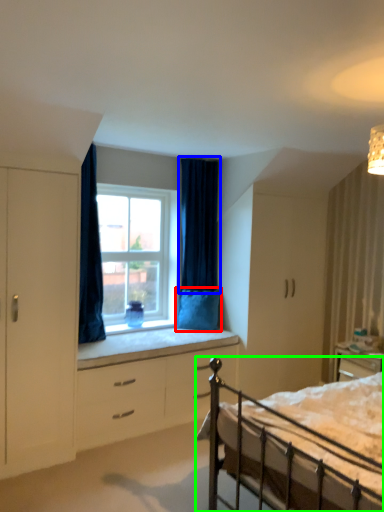
Question: Which is farther away from pillow (highlighted by a red box)? curtain (highlighted by a blue box) or bed (highlighted by a green box)?

Choices:
 (A) curtain
 (B) bed

Answer: (B)